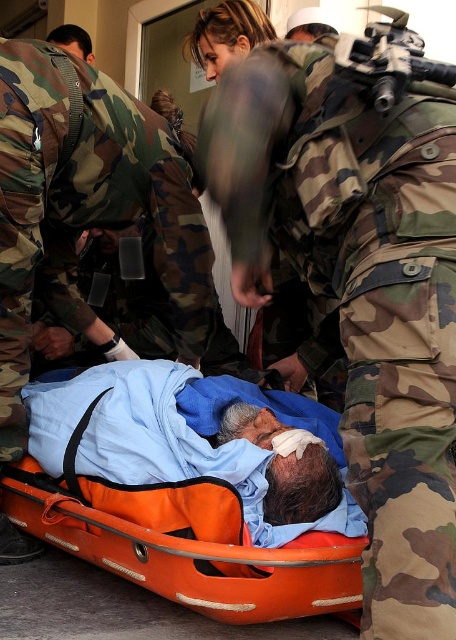
Question: Can you confirm if camo uniform at center is positioned below orange plastic stretcher at center?

Choices:
 (A) yes
 (B) no

Answer: (B)

Question: Can you confirm if camo uniform at center is bigger than orange plastic stretcher at center?

Choices:
 (A) yes
 (B) no

Answer: (A)

Question: Which point is closer to the camera?

Choices:
 (A) (343, 468)
 (B) (214, 161)

Answer: (B)

Question: Which point is closer to the camera?

Choices:
 (A) orange plastic stretcher at center
 (B) camo uniform at center

Answer: (B)

Question: Which object appears farthest from the camera in this image?

Choices:
 (A) orange plastic stretcher at center
 (B) camo uniform at center

Answer: (A)

Question: Can you confirm if camo uniform at center is bigger than orange plastic stretcher at center?

Choices:
 (A) yes
 (B) no

Answer: (A)